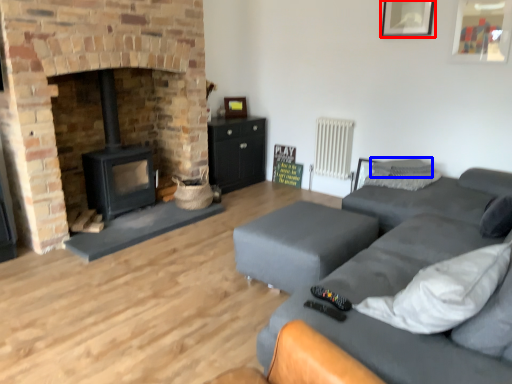
Question: Which object is further to the camera taking this photo, picture frame (highlighted by a red box) or pillow (highlighted by a blue box)?

Choices:
 (A) picture frame
 (B) pillow

Answer: (B)